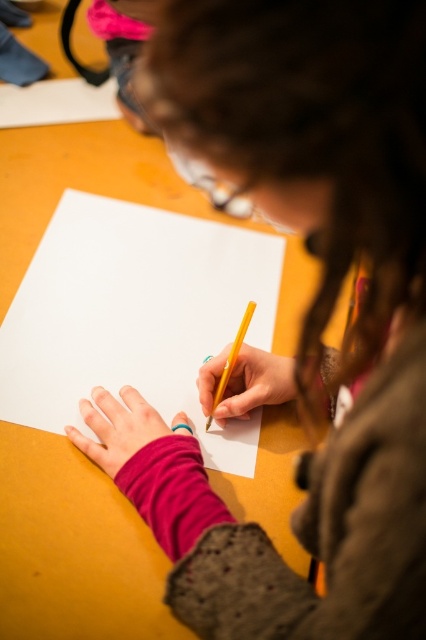
Who is higher up, wooden table at center or white paper at center?

wooden table at center is higher up.

Is wooden table at center below white paper at center?

Incorrect, wooden table at center is not positioned below white paper at center.

Who is more forward, (276, 436) or (242, 422)?

Point (276, 436) is in front.

Locate an element on the screen. The image size is (426, 640). wooden table at center is located at coordinates (72, 548).

Between white paper at center and yellow matte pencil at center, which one has less height?

yellow matte pencil at center is shorter.

Is white paper at center wider than yellow matte pencil at center?

Yes, white paper at center is wider than yellow matte pencil at center.

Describe the element at coordinates (135, 316) in the screenshot. I see `white paper at center` at that location.

Locate an element on the screen. white paper at center is located at coordinates (135, 316).

Does point (101, 504) come behind point (233, 356)?

No, (101, 504) is closer to viewer.

How distant is wooden table at center from yellow matte pencil at center?

wooden table at center is 25.16 centimeters away from yellow matte pencil at center.

The image size is (426, 640). Identify the location of wooden table at center. point(72,548).